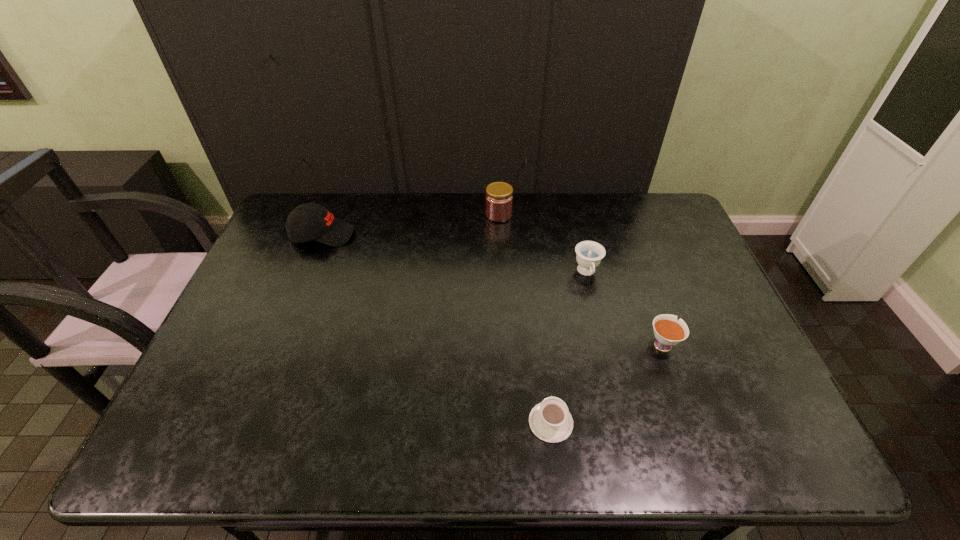
This screenshot has width=960, height=540. I want to click on object that is at the left edge, so click(x=311, y=221).

You are a GUI agent. You are given a task and a screenshot of the screen. Output one action in this format:
    pyautogui.click(x=<x>, y=<y>)
    Task: Click on the object that is at the far left corner
    Image resolution: width=960 pixels, height=540 pixels.
    Given the screenshot: What is the action you would take?
    pyautogui.click(x=311, y=221)

You are a GUI agent. You are given a task and a screenshot of the screen. Output one action in this format:
    pyautogui.click(x=<x>, y=<y>)
    Task: Click on the blank area at the far edge
    This screenshot has height=540, width=960.
    Given the screenshot: What is the action you would take?
    pyautogui.click(x=383, y=197)

Identify the location of free spot at the near edge of the desktop. (481, 437).

At what (x,y) coordinates should I click in order to perform the action: click on vacant point at the left edge. Please return your answer as a coordinate pair (x, y). This screenshot has height=540, width=960. Looking at the image, I should click on (233, 341).

Locate an element on the screen. This screenshot has width=960, height=540. vacant space at the right edge of the desktop is located at coordinates (704, 293).

This screenshot has width=960, height=540. In the image, there is a desktop. In order to click on vacant region at the far left corner in this screenshot , I will do `click(289, 210)`.

Locate an element on the screen. vacant region between the nearest object and the jam is located at coordinates (525, 318).

This screenshot has width=960, height=540. Find the location of `blank region between the second nearest teacup and the third nearest object`. blank region between the second nearest teacup and the third nearest object is located at coordinates (624, 308).

At what (x,y) coordinates should I click in order to perform the action: click on vacant space in between the second teacup from right to left and the leftmost object. Please return your answer as a coordinate pair (x, y). The image size is (960, 540). Looking at the image, I should click on (455, 254).